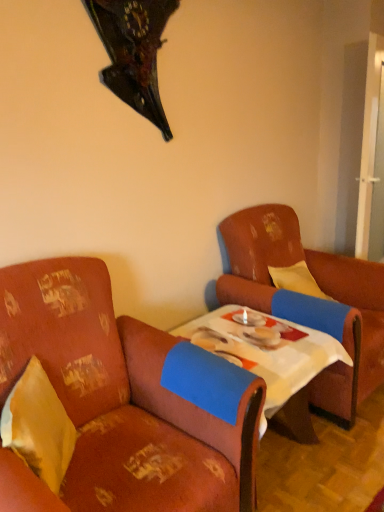
Question: Does white cloth-covered table at center contain leather armchair at right, acting as the first chair starting from the right?

Choices:
 (A) yes
 (B) no

Answer: (B)

Question: From a real-world perspective, is white cloth-covered table at center under leather armchair at right, acting as the second chair starting from the left?

Choices:
 (A) yes
 (B) no

Answer: (A)

Question: Considering the relative sizes of white cloth-covered table at center and leather armchair at right, acting as the second chair starting from the left, in the image provided, is white cloth-covered table at center shorter than leather armchair at right, acting as the second chair starting from the left,?

Choices:
 (A) yes
 (B) no

Answer: (A)

Question: Considering the relative positions of white cloth-covered table at center and leather armchair at right, acting as the first chair starting from the right, in the image provided, is white cloth-covered table at center behind leather armchair at right, acting as the first chair starting from the right,?

Choices:
 (A) no
 (B) yes

Answer: (A)

Question: Is white cloth-covered table at center in contact with leather armchair at right, acting as the second chair starting from the left?

Choices:
 (A) no
 (B) yes

Answer: (A)

Question: Considering the positions of point (44, 379) and point (251, 270), is point (44, 379) closer or farther from the camera than point (251, 270)?

Choices:
 (A) farther
 (B) closer

Answer: (B)

Question: Based on their sizes in the image, would you say yellow fabric pillow at left is bigger or smaller than leather armchair at right, acting as the second chair starting from the left?

Choices:
 (A) small
 (B) big

Answer: (A)

Question: Visually, is yellow fabric pillow at left positioned to the left or to the right of leather armchair at right, acting as the second chair starting from the left?

Choices:
 (A) left
 (B) right

Answer: (A)

Question: In the image, is yellow fabric pillow at left positioned in front of or behind leather armchair at right, acting as the second chair starting from the left?

Choices:
 (A) behind
 (B) front

Answer: (B)

Question: Considering their positions, is white cloth-covered table at center located in front of or behind leather armchair at right, acting as the second chair starting from the left?

Choices:
 (A) front
 (B) behind

Answer: (A)

Question: Is white cloth-covered table at center spatially inside leather armchair at right, acting as the first chair starting from the right, or outside of it?

Choices:
 (A) outside
 (B) inside

Answer: (A)

Question: Visually, is white cloth-covered table at center positioned to the left or to the right of leather armchair at right, acting as the second chair starting from the left?

Choices:
 (A) right
 (B) left

Answer: (B)

Question: From the image's perspective, is white cloth-covered table at center positioned above or below leather armchair at right, acting as the first chair starting from the right?

Choices:
 (A) below
 (B) above

Answer: (A)

Question: Considering their positions, is floral fabric armchair at left, placed as the first chair when sorted from left to right, located in front of or behind white cloth-covered table at center?

Choices:
 (A) behind
 (B) front

Answer: (B)

Question: From the image's perspective, is floral fabric armchair at left, the 2th chair positioned from the right, above or below white cloth-covered table at center?

Choices:
 (A) below
 (B) above

Answer: (A)